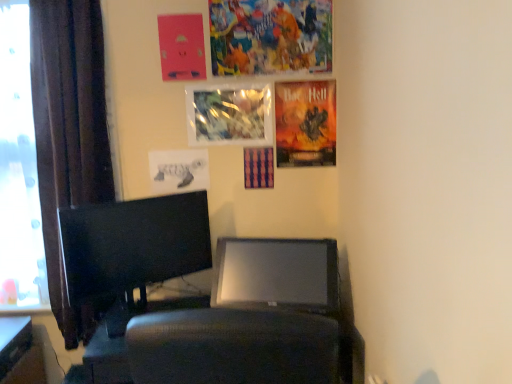
Describe the element at coordinates (69, 136) in the screenshot. I see `dark brown fabric curtain at left` at that location.

This screenshot has width=512, height=384. What do you see at coordinates (229, 114) in the screenshot?
I see `metallic reflective poster at upper center, the 3th poster page positioned from the top` at bounding box center [229, 114].

This screenshot has width=512, height=384. What are the coordinates of `orange matte poster at upper right, acting as the second poster page starting from the bottom` in the screenshot? It's located at (305, 123).

Measure the distance between black fabric computer chair at center and camera.

The depth of black fabric computer chair at center is 1.66 meters.

This screenshot has width=512, height=384. What are the coordinates of `matte black desk at lower left` in the screenshot? It's located at (20, 353).

Measure the distance between black glossy monitor at left and camera.

They are 1.64 meters apart.

Where is `transparent glass window at left`? The width and height of the screenshot is (512, 384). transparent glass window at left is located at coordinates point(19,171).

Locate an element on the screen. dark brown fabric curtain at left is located at coordinates (69, 136).

Which is farther from the camera, (1, 190) or (168, 166)?

The point (168, 166) is more distant.

Between transparent glass window at left and white matte poster at center, the fifth poster page in the top-to-bottom sequence, which one has smaller width?

white matte poster at center, the fifth poster page in the top-to-bottom sequence, is thinner.

Consider the image. Who is taller, matte pink poster at upper center, the fourth poster page when ordered from bottom to top, or dark brown fabric curtain at left?

Standing taller between the two is dark brown fabric curtain at left.

Between matte pink poster at upper center, which appears as the 2th poster page when viewed from the top, and dark brown fabric curtain at left, which one is positioned behind?

matte pink poster at upper center, which appears as the 2th poster page when viewed from the top, is further from the camera.

The width and height of the screenshot is (512, 384). Identify the location of poster page that is the 2nd one when counting backward from the dark brown fabric curtain at left. (181, 47).

Which of these two, matte pink poster at upper center, the fourth poster page when ordered from bottom to top, or dark brown fabric curtain at left, is bigger?

dark brown fabric curtain at left is bigger.

Is transparent glass window at left placed right next to matte pink poster at upper center, the fourth poster page when ordered from bottom to top?

No, transparent glass window at left is not next to matte pink poster at upper center, the fourth poster page when ordered from bottom to top.

Can you tell me how much transparent glass window at left and matte pink poster at upper center, which appears as the 2th poster page when viewed from the top, differ in facing direction?

They differ by 0.014 degrees in their facing directions.

From the image's perspective, is transparent glass window at left under matte pink poster at upper center, which appears as the 2th poster page when viewed from the top?

Correct, transparent glass window at left appears lower than matte pink poster at upper center, which appears as the 2th poster page when viewed from the top, in the image.

From a real-world perspective, which is physically above, transparent glass window at left or matte pink poster at upper center, which appears as the 2th poster page when viewed from the top?

In real-world perspective, matte pink poster at upper center, which appears as the 2th poster page when viewed from the top, is above.

Does dark brown fabric curtain at left touch transparent glass window at left?

dark brown fabric curtain at left is not next to transparent glass window at left, and they're not touching.

From a real-world perspective, is dark brown fabric curtain at left positioned over transparent glass window at left based on gravity?

Actually, dark brown fabric curtain at left is physically below transparent glass window at left in the real world.

Is dark brown fabric curtain at left to the left of transparent glass window at left from the viewer's perspective?

In fact, dark brown fabric curtain at left is to the right of transparent glass window at left.

Which is in front, point (54, 70) or point (0, 87)?

Point (54, 70)

From a real-world perspective, between colorful collage at upper center, placed as the first poster page when sorted from top to bottom, and matte pink poster at upper center, the fourth poster page when ordered from bottom to top, who is vertically lower?

matte pink poster at upper center, the fourth poster page when ordered from bottom to top.

Between colorful collage at upper center, placed as the first poster page when sorted from top to bottom, and matte pink poster at upper center, the fourth poster page when ordered from bottom to top, which one has larger width?

With larger width is colorful collage at upper center, placed as the first poster page when sorted from top to bottom.

Locate an element on the screen. the 1st poster page positioned below the colorful collage at upper center, placed as the first poster page when sorted from top to bottom (from the image's perspective) is located at coordinates (181, 47).

From the picture: Is colorful collage at upper center, which appears as the 5th poster page when ordered from the bottom, inside or outside of matte pink poster at upper center, the fourth poster page when ordered from bottom to top?

colorful collage at upper center, which appears as the 5th poster page when ordered from the bottom, is spatially situated outside matte pink poster at upper center, the fourth poster page when ordered from bottom to top.

Which object is closer to the camera, dark brown fabric curtain at left or black fabric computer chair at center?

black fabric computer chair at center.

Does dark brown fabric curtain at left have a greater width compared to black fabric computer chair at center?

Incorrect, the width of dark brown fabric curtain at left does not surpass that of black fabric computer chair at center.

Choose the correct answer: Is dark brown fabric curtain at left inside black fabric computer chair at center or outside it?

dark brown fabric curtain at left is not inside black fabric computer chair at center, it's outside.

Is dark brown fabric curtain at left not near black fabric computer chair at center?

No, dark brown fabric curtain at left is not far from black fabric computer chair at center.

Which object is further away from the camera, black glossy monitor at left or metallic reflective poster at upper center, which is counted as the 3th poster page, starting from the bottom?

metallic reflective poster at upper center, which is counted as the 3th poster page, starting from the bottom.

Looking at the image, does black glossy monitor at left seem bigger or smaller compared to metallic reflective poster at upper center, which is counted as the 3th poster page, starting from the bottom?

black glossy monitor at left is bigger than metallic reflective poster at upper center, which is counted as the 3th poster page, starting from the bottom.

Would you say black glossy monitor at left is outside metallic reflective poster at upper center, which is counted as the 3th poster page, starting from the bottom?

Indeed, black glossy monitor at left is completely outside metallic reflective poster at upper center, which is counted as the 3th poster page, starting from the bottom.

Locate an element on the screen. window screen on the left side of white matte poster at center, the fifth poster page in the top-to-bottom sequence is located at coordinates (19, 171).

You are a GUI agent. You are given a task and a screenshot of the screen. Output one action in this format:
    pyautogui.click(x=<x>, y=<y>)
    Task: Click on the curtain lying below the matte pink poster at upper center, the fourth poster page when ordered from bottom to top (from the image's perspective)
    Image resolution: width=512 pixels, height=384 pixels.
    Given the screenshot: What is the action you would take?
    tap(69, 136)

Looking at the image, which one is located further to black fabric computer chair at center, white matte poster at center, the 1th poster page from the bottom, or orange matte poster at upper right, acting as the 4th poster page starting from the top?

orange matte poster at upper right, acting as the 4th poster page starting from the top.

From the image, which object appears to be farther from black glossy monitor at left, transparent glass window at left or matte black desk at lower left?

Based on the image, matte black desk at lower left appears to be further to black glossy monitor at left.

Based on the photo, from the image, which object appears to be farther from transparent glass window at left, dark brown fabric curtain at left or black fabric computer chair at center?

Based on the image, black fabric computer chair at center appears to be further to transparent glass window at left.

From the image, which object appears to be nearer to white matte poster at center, the fifth poster page in the top-to-bottom sequence, matte pink poster at upper center, which appears as the 2th poster page when viewed from the top, or dark brown fabric curtain at left?

dark brown fabric curtain at left.

Based on the photo, considering their positions, is orange matte poster at upper right, acting as the 4th poster page starting from the top, positioned closer to matte pink poster at upper center, the fourth poster page when ordered from bottom to top, than transparent glass window at left?

The object closer to matte pink poster at upper center, the fourth poster page when ordered from bottom to top, is orange matte poster at upper right, acting as the 4th poster page starting from the top.

Which object lies nearer to the anchor point black fabric computer chair at center, matte black desk at lower left or matte pink poster at upper center, the fourth poster page when ordered from bottom to top?

matte pink poster at upper center, the fourth poster page when ordered from bottom to top, is positioned closer to the anchor black fabric computer chair at center.

When comparing their distances from transparent glass window at left, does white matte poster at center, the 1th poster page from the bottom, or matte pink poster at upper center, which appears as the 2th poster page when viewed from the top, seem closer?

white matte poster at center, the 1th poster page from the bottom.

From the image, which object appears to be nearer to black fabric computer chair at center, white matte poster at center, the fifth poster page in the top-to-bottom sequence, or transparent glass window at left?

white matte poster at center, the fifth poster page in the top-to-bottom sequence.

Where is `computer monitor located between black fabric computer chair at center and white matte poster at center, the 1th poster page from the bottom, in the depth direction`? This screenshot has height=384, width=512. computer monitor located between black fabric computer chair at center and white matte poster at center, the 1th poster page from the bottom, in the depth direction is located at coordinates (133, 244).

The height and width of the screenshot is (384, 512). I want to click on curtain between colorful collage at upper center, placed as the first poster page when sorted from top to bottom, and black glossy monitor at left from top to bottom, so click(69, 136).

This screenshot has width=512, height=384. What are the coordinates of `computer monitor between dark brown fabric curtain at left and matte black desk at lower left in the up-down direction` in the screenshot? It's located at (133, 244).

I want to click on curtain between black glossy monitor at left and white matte poster at center, the 1th poster page from the bottom, from front to back, so click(69, 136).